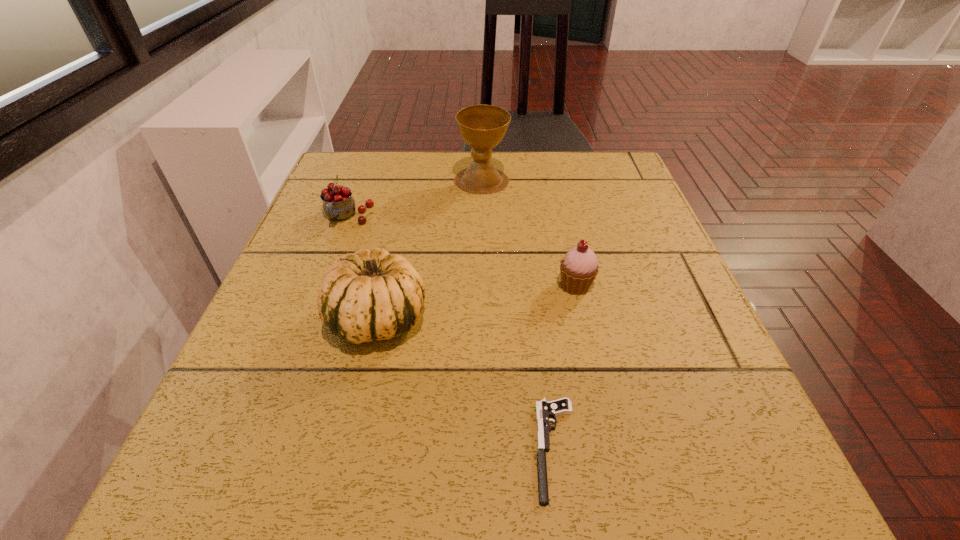
I want to click on free spot between the third object from right to left and the shortest object, so click(518, 315).

Where is `free space between the cherry and the third object from left to right`? Image resolution: width=960 pixels, height=540 pixels. free space between the cherry and the third object from left to right is located at coordinates (415, 199).

Identify the location of free space between the shortest object and the farthest object. 518,315.

Identify the location of free space between the second farthest object and the shortest object. The image size is (960, 540). pos(452,333).

The height and width of the screenshot is (540, 960). What are the coordinates of `vacant point located between the rightmost object and the third object from left to right` in the screenshot? It's located at (529, 233).

Identify the location of object identified as the second closest to the nearest object. The height and width of the screenshot is (540, 960). (579, 267).

Identify the location of the closest object to the gourd. This screenshot has width=960, height=540. click(338, 204).

Where is `vacant space that satisfies the following two spatial constraints: 1. on the handle side of the second tallest object; 2. on the right side of the cherry`? vacant space that satisfies the following two spatial constraints: 1. on the handle side of the second tallest object; 2. on the right side of the cherry is located at coordinates (309, 319).

The image size is (960, 540). Identify the location of free space in the image that satisfies the following two spatial constraints: 1. on the handle side of the fourth nearest object; 2. on the right side of the cupcake. (322, 286).

Identify the location of vacant region that satisfies the following two spatial constraints: 1. on the back side of the gourd; 2. on the left side of the chalice. (410, 180).